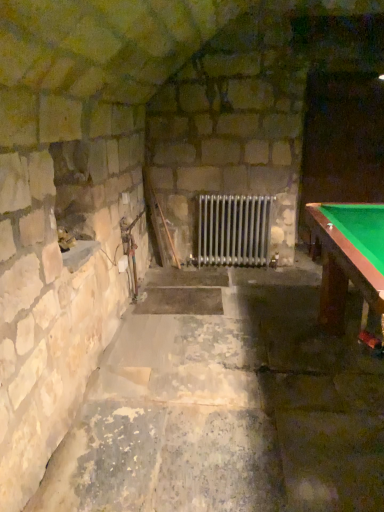
Where is `silver metallic radiator at center`? The height and width of the screenshot is (512, 384). silver metallic radiator at center is located at coordinates (233, 230).

Measure the distance between point (250,224) and camera.

The distance of point (250,224) from camera is 13.71 feet.

Describe the element at coordinates (233, 230) in the screenshot. This screenshot has width=384, height=512. I see `silver metallic radiator at center` at that location.

This screenshot has height=512, width=384. Find the location of `silver metallic radiator at center`. silver metallic radiator at center is located at coordinates (233, 230).